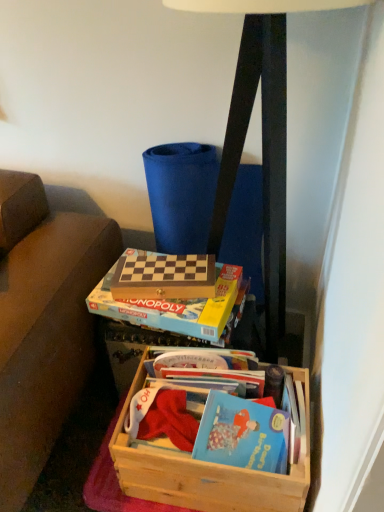
Question: Is hardcover book at center, which is the 2th paperback book from back to front, wider than wooden crate at lower center?

Choices:
 (A) no
 (B) yes

Answer: (A)

Question: Does hardcover book at center, which is counted as the 1th paperback book, starting from the front, have a lesser height compared to wooden crate at lower center?

Choices:
 (A) no
 (B) yes

Answer: (B)

Question: Considering the relative sizes of hardcover book at center, which is the 2th paperback book from back to front, and wooden crate at lower center in the image provided, is hardcover book at center, which is the 2th paperback book from back to front, smaller than wooden crate at lower center?

Choices:
 (A) yes
 (B) no

Answer: (A)

Question: Can wooden crate at lower center be found inside hardcover book at center, which is counted as the 1th paperback book, starting from the front?

Choices:
 (A) no
 (B) yes

Answer: (A)

Question: Does hardcover book at center, which is the 2th paperback book from back to front, lie behind wooden crate at lower center?

Choices:
 (A) no
 (B) yes

Answer: (B)

Question: From the image's perspective, is wooden crate at lower center located above or below wooden board game at center, arranged as the second paperback book when viewed from the front?

Choices:
 (A) above
 (B) below

Answer: (B)

Question: In terms of width, does wooden crate at lower center look wider or thinner when compared to wooden board game at center, arranged as the second paperback book when viewed from the front?

Choices:
 (A) wide
 (B) thin

Answer: (A)

Question: Choose the correct answer: Is wooden crate at lower center inside wooden board game at center, arranged as the second paperback book when viewed from the front, or outside it?

Choices:
 (A) outside
 (B) inside

Answer: (A)

Question: Is point (157, 484) positioned closer to the camera than point (140, 268)?

Choices:
 (A) farther
 (B) closer

Answer: (B)

Question: Considering the positions of wooden board game at center, arranged as the second paperback book when viewed from the front, and wooden crate at lower center in the image, is wooden board game at center, arranged as the second paperback book when viewed from the front, wider or thinner than wooden crate at lower center?

Choices:
 (A) wide
 (B) thin

Answer: (B)

Question: From the image's perspective, is wooden board game at center, the 1th paperback book in the back-to-front sequence, located above or below wooden crate at lower center?

Choices:
 (A) above
 (B) below

Answer: (A)

Question: Considering the positions of point (201, 269) and point (153, 449), is point (201, 269) closer or farther from the camera than point (153, 449)?

Choices:
 (A) closer
 (B) farther

Answer: (B)

Question: Would you say wooden board game at center, arranged as the second paperback book when viewed from the front, is to the left or to the right of wooden crate at lower center in the picture?

Choices:
 (A) left
 (B) right

Answer: (A)

Question: In the image, is hardcover book at center, which is the 2th paperback book from back to front, positioned in front of or behind matte black lamp at upper center?

Choices:
 (A) front
 (B) behind

Answer: (B)

Question: From the image's perspective, relative to matte black lamp at upper center, is hardcover book at center, which is the 2th paperback book from back to front, above or below?

Choices:
 (A) above
 (B) below

Answer: (B)